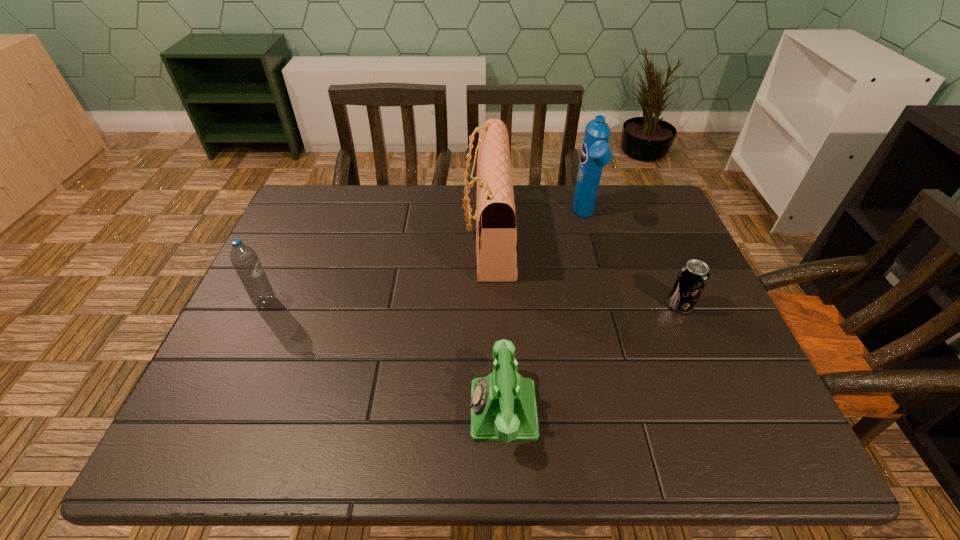
At what (x,y) coordinates should I click in order to perform the action: click on vacant area situated on the front of the third shortest object. Please return your answer as a coordinate pair (x, y). Looking at the image, I should click on (245, 348).

Find the location of `free space located 0.370m on the back of the soda can`. free space located 0.370m on the back of the soda can is located at coordinates (637, 206).

You are a GUI agent. You are given a task and a screenshot of the screen. Output one action in this format:
    pyautogui.click(x=<x>, y=<y>)
    Task: Click on the vacant space situated 0.330m on the dial of the telephone
    Image resolution: width=960 pixels, height=540 pixels.
    Given the screenshot: What is the action you would take?
    pyautogui.click(x=302, y=410)

Where is `free space located 0.150m on the dial of the telephone`? The height and width of the screenshot is (540, 960). free space located 0.150m on the dial of the telephone is located at coordinates (394, 410).

Identify the location of free space located on the dial of the telephone. (343, 410).

Locate an element on the screen. shampoo at the far edge is located at coordinates (596, 153).

Identify the location of handbag present at the far edge. (496, 236).

Locate an element on the screen. The height and width of the screenshot is (540, 960). object present at the near edge is located at coordinates (503, 407).

At what (x,y) coordinates should I click in order to perform the action: click on object situated at the left edge. Please return your answer as a coordinate pair (x, y). The width and height of the screenshot is (960, 540). Looking at the image, I should click on (244, 259).

Identify the location of object positioned at the right edge. (693, 275).